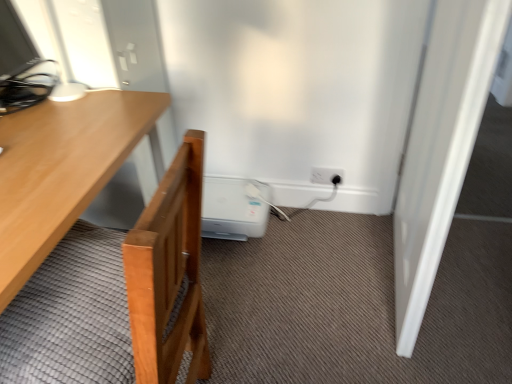
Question: Is white smooth door at right a part of white plastic water heater at lower center?

Choices:
 (A) no
 (B) yes

Answer: (A)

Question: Is white plastic water heater at lower center not close to white smooth door at right?

Choices:
 (A) yes
 (B) no

Answer: (B)

Question: Is white smooth door at right at the back of white plastic water heater at lower center?

Choices:
 (A) no
 (B) yes

Answer: (A)

Question: From the image's perspective, does white plastic water heater at lower center appear lower than white smooth door at right?

Choices:
 (A) yes
 (B) no

Answer: (A)

Question: Can you confirm if white plastic water heater at lower center is smaller than white smooth door at right?

Choices:
 (A) yes
 (B) no

Answer: (A)

Question: Considering the relative positions of white smooth door at right and wooden desk at left in the image provided, is white smooth door at right to the left or to the right of wooden desk at left?

Choices:
 (A) right
 (B) left

Answer: (A)

Question: Considering the positions of point (424, 157) and point (119, 162), is point (424, 157) closer or farther from the camera than point (119, 162)?

Choices:
 (A) closer
 (B) farther

Answer: (B)

Question: In terms of height, does white smooth door at right look taller or shorter compared to wooden desk at left?

Choices:
 (A) short
 (B) tall

Answer: (B)

Question: Is white smooth door at right in front of or behind wooden desk at left in the image?

Choices:
 (A) front
 (B) behind

Answer: (B)

Question: Considering the positions of wooden desk at left and white plastic water heater at lower center in the image, is wooden desk at left wider or thinner than white plastic water heater at lower center?

Choices:
 (A) thin
 (B) wide

Answer: (B)

Question: From the image's perspective, is wooden desk at left positioned above or below white plastic water heater at lower center?

Choices:
 (A) above
 (B) below

Answer: (B)

Question: From a real-world perspective, is wooden desk at left physically located above or below white plastic water heater at lower center?

Choices:
 (A) below
 (B) above

Answer: (B)

Question: Is wooden desk at left in front of or behind white plastic water heater at lower center in the image?

Choices:
 (A) front
 (B) behind

Answer: (A)

Question: From a real-world perspective, relative to wooden desk at left, is white plastic electric outlet at lower right vertically above or below?

Choices:
 (A) above
 (B) below

Answer: (B)

Question: Is point (321, 168) closer or farther from the camera than point (2, 296)?

Choices:
 (A) closer
 (B) farther

Answer: (B)